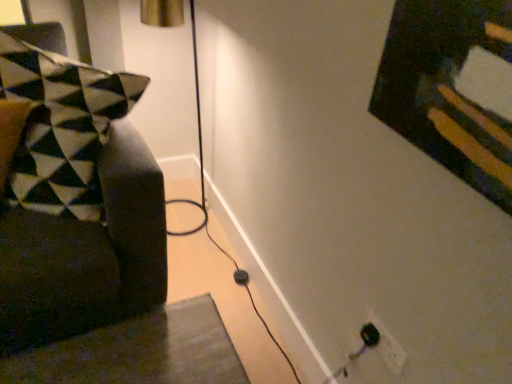
Where is `black plastic electric outlet at lower right`? The height and width of the screenshot is (384, 512). black plastic electric outlet at lower right is located at coordinates (388, 346).

This screenshot has height=384, width=512. What do you see at coordinates (388, 346) in the screenshot? I see `black plastic electric outlet at lower right` at bounding box center [388, 346].

What is the approximate height of velvet black pillow at left?

It is 77.66 centimeters.

You are a GUI agent. You are given a task and a screenshot of the screen. Output one action in this format:
    pyautogui.click(x=<x>, y=<y>)
    Task: Click on the velvet black pillow at left
    The image size is (512, 384).
    Given the screenshot: What is the action you would take?
    pyautogui.click(x=87, y=255)

The width and height of the screenshot is (512, 384). Describe the element at coordinates (87, 255) in the screenshot. I see `velvet black pillow at left` at that location.

Locate an element on the screen. black plastic electric outlet at lower right is located at coordinates (388, 346).

Is velvet black pillow at left to the left of black plastic electric outlet at lower right from the viewer's perspective?

Yes, velvet black pillow at left is to the left of black plastic electric outlet at lower right.

Which object is closer to the camera, velvet black pillow at left or black plastic electric outlet at lower right?

Positioned in front is velvet black pillow at left.

Between point (96, 273) and point (373, 316), which one is positioned behind?

The point (96, 273) is behind.

From the image's perspective, is velvet black pillow at left under black plastic electric outlet at lower right?

No, from the image's perspective, velvet black pillow at left is not beneath black plastic electric outlet at lower right.

From a real-world perspective, between velvet black pillow at left and black plastic electric outlet at lower right, who is vertically higher?

From a 3D spatial view, velvet black pillow at left is above.

Between velvet black pillow at left and black plastic electric outlet at lower right, which one has smaller width?

black plastic electric outlet at lower right is thinner.

Considering the relative sizes of velvet black pillow at left and black plastic electric outlet at lower right in the image provided, is velvet black pillow at left shorter than black plastic electric outlet at lower right?

No, velvet black pillow at left is not shorter than black plastic electric outlet at lower right.

Looking at the image, does velvet black pillow at left seem bigger or smaller compared to black plastic electric outlet at lower right?

Considering their sizes, velvet black pillow at left takes up more space than black plastic electric outlet at lower right.

Based on the photo, is velvet black pillow at left situated inside black plastic electric outlet at lower right or outside?

velvet black pillow at left is not enclosed by black plastic electric outlet at lower right.

Is velvet black pillow at left placed right next to black plastic electric outlet at lower right?

velvet black pillow at left is not next to black plastic electric outlet at lower right, and they're not touching.

Is velvet black pillow at left aimed at black plastic electric outlet at lower right?

No, velvet black pillow at left is not oriented towards black plastic electric outlet at lower right.

How different are the orientations of velvet black pillow at left and black plastic electric outlet at lower right in degrees?

The angular difference between velvet black pillow at left and black plastic electric outlet at lower right is 48.7 degrees.

Image resolution: width=512 pixels, height=384 pixels. I want to click on furniture in front of the black plastic electric outlet at lower right, so click(x=87, y=255).

Can you confirm if black plastic electric outlet at lower right is positioned to the left of velvet black pillow at left?

No, black plastic electric outlet at lower right is not to the left of velvet black pillow at left.

Who is more distant, black plastic electric outlet at lower right or velvet black pillow at left?

black plastic electric outlet at lower right is further from the camera.

Is point (388, 356) closer or farther from the camera than point (149, 242)?

Clearly, point (388, 356) is closer to the camera than point (149, 242).

From the image's perspective, is black plastic electric outlet at lower right located beneath velvet black pillow at left?

Yes, from the image's perspective, black plastic electric outlet at lower right is below velvet black pillow at left.

From a real-world perspective, is black plastic electric outlet at lower right physically below velvet black pillow at left?

Yes.

Can you confirm if black plastic electric outlet at lower right is thinner than velvet black pillow at left?

Yes.

In terms of height, does black plastic electric outlet at lower right look taller or shorter compared to velvet black pillow at left?

Considering their sizes, black plastic electric outlet at lower right has less height than velvet black pillow at left.

Can you confirm if black plastic electric outlet at lower right is bigger than velvet black pillow at left?

No.

Choose the correct answer: Is black plastic electric outlet at lower right inside velvet black pillow at left or outside it?

black plastic electric outlet at lower right is spatially situated outside velvet black pillow at left.

Is the surface of black plastic electric outlet at lower right in direct contact with velvet black pillow at left?

No, black plastic electric outlet at lower right is not touching velvet black pillow at left.

Is black plastic electric outlet at lower right aimed at velvet black pillow at left?

No, black plastic electric outlet at lower right is not oriented towards velvet black pillow at left.

Measure the distance from black plastic electric outlet at lower right to velvet black pillow at left.

black plastic electric outlet at lower right is 36.07 inches from velvet black pillow at left.

The height and width of the screenshot is (384, 512). In the image, there is a velvet black pillow at left. In order to click on electric outlet below it (from the image's perspective) in this screenshot , I will do `click(388, 346)`.

This screenshot has height=384, width=512. Find the location of `furniture in front of the black plastic electric outlet at lower right`. furniture in front of the black plastic electric outlet at lower right is located at coordinates (87, 255).

The height and width of the screenshot is (384, 512). I want to click on furniture above the black plastic electric outlet at lower right (from a real-world perspective), so click(87, 255).